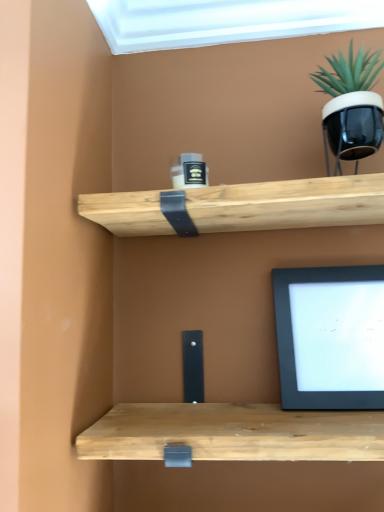
Question: Looking at the image, does black glossy pot at upper right seem bigger or smaller compared to black matte computer monitor at lower right?

Choices:
 (A) big
 (B) small

Answer: (A)

Question: From a real-world perspective, is black glossy pot at upper right above or below black matte computer monitor at lower right?

Choices:
 (A) above
 (B) below

Answer: (A)

Question: Considering their positions, is black glossy pot at upper right located in front of or behind black matte computer monitor at lower right?

Choices:
 (A) behind
 (B) front

Answer: (B)

Question: Considering their positions, is black matte computer monitor at lower right located in front of or behind black glossy pot at upper right?

Choices:
 (A) behind
 (B) front

Answer: (A)

Question: Would you say black matte computer monitor at lower right is to the left or to the right of black glossy pot at upper right in the picture?

Choices:
 (A) right
 (B) left

Answer: (B)

Question: From their relative heights in the image, would you say black matte computer monitor at lower right is taller or shorter than black glossy pot at upper right?

Choices:
 (A) tall
 (B) short

Answer: (A)

Question: From the image's perspective, is black matte computer monitor at lower right located above or below black glossy pot at upper right?

Choices:
 (A) above
 (B) below

Answer: (B)